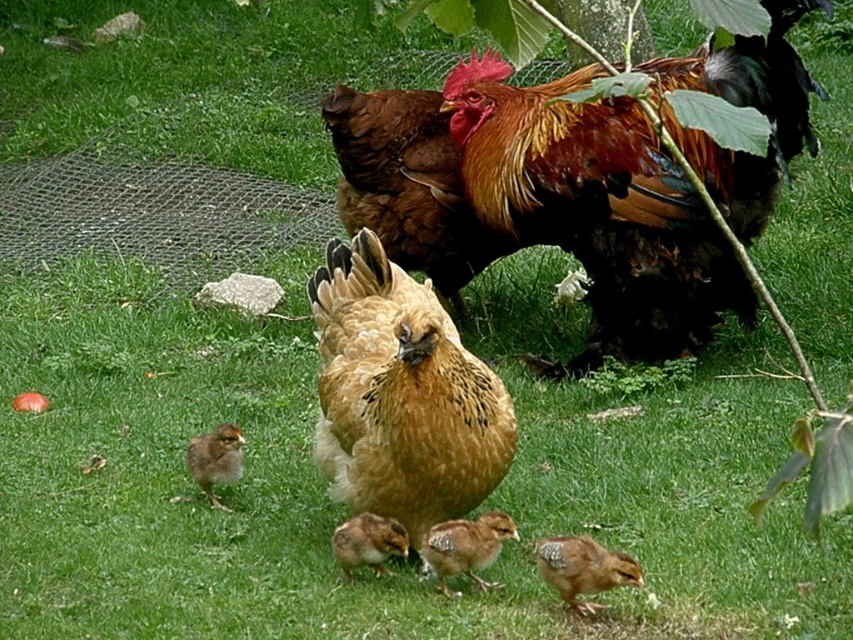
Is point (657, 272) less distant than point (386, 516)?

No, (657, 272) is further to viewer.

Is golden feathered rooster at upper right smaller than speckled feathered chick at center?

Actually, golden feathered rooster at upper right might be larger than speckled feathered chick at center.

Between point (708, 240) and point (392, 522), which one is positioned behind?

Point (708, 240)

Identify the location of golden feathered rooster at upper right. (596, 209).

Is golden feathered rooster at upper right wider than brown speckled chick at lower left?

Yes.

Does golden feathered rooster at upper right have a larger size compared to brown speckled chick at lower left?

Correct, golden feathered rooster at upper right is larger in size than brown speckled chick at lower left.

I want to click on golden feathered rooster at upper right, so click(596, 209).

Between point (486, 532) and point (236, 467), which one is positioned in front?

Point (486, 532)

Does brown speckled chick at center have a lesser height compared to brown speckled chick at lower left?

Indeed, brown speckled chick at center has a lesser height compared to brown speckled chick at lower left.

Does point (486, 525) come in front of point (192, 456)?

Yes, it is.

Image resolution: width=853 pixels, height=640 pixels. Find the location of `brown speckled chick at center`. brown speckled chick at center is located at coordinates (465, 547).